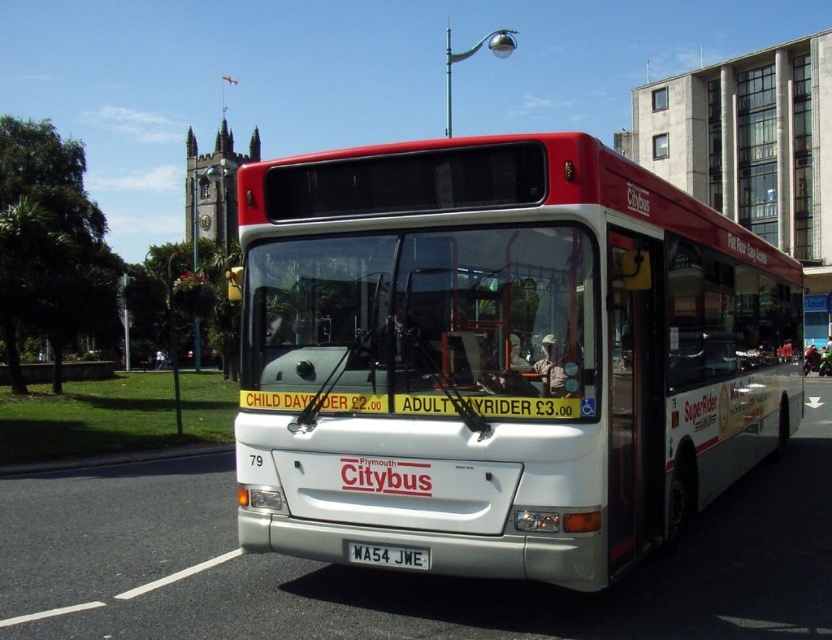
Looking at this image, who is positioned more to the right, white matte bus at center or white metallic license plate at center?

white matte bus at center

Does white matte bus at center have a lesser height compared to white metallic license plate at center?

Incorrect, white matte bus at center's height does not fall short of white metallic license plate at center's.

Describe the element at coordinates (499, 355) in the screenshot. I see `white matte bus at center` at that location.

You are a GUI agent. You are given a task and a screenshot of the screen. Output one action in this format:
    pyautogui.click(x=<x>, y=<y>)
    Task: Click on the white matte bus at center
    The image size is (832, 640).
    Given the screenshot: What is the action you would take?
    pyautogui.click(x=499, y=355)